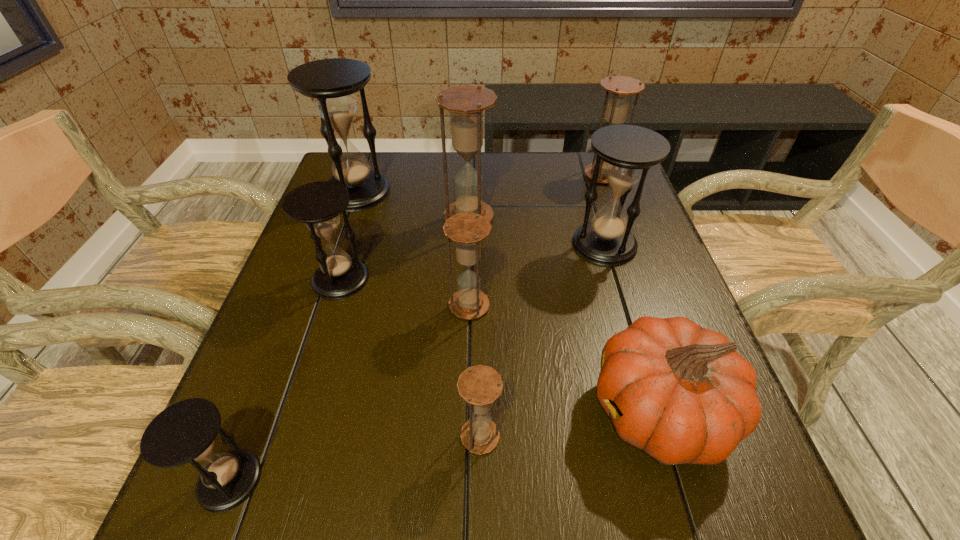
Identify the location of free space at the left edge of the desktop. The width and height of the screenshot is (960, 540). (348, 254).

In the image, there is a desktop. Where is `vacant area at the far left corner`? The width and height of the screenshot is (960, 540). vacant area at the far left corner is located at coordinates (331, 173).

This screenshot has height=540, width=960. I want to click on vacant space at the near left corner of the desktop, so click(282, 528).

Locate an element on the screen. vacant region at the far right corner of the desktop is located at coordinates (588, 165).

Locate an element on the screen. This screenshot has width=960, height=540. free space between the pumpkin and the third biggest black hourglass is located at coordinates (500, 345).

Find the location of a particular element. The height and width of the screenshot is (540, 960). blank region between the smallest black hourglass and the second smallest black hourglass is located at coordinates (285, 380).

Locate an element on the screen. unoccupied area between the second smallest brown hourglass and the farthest black hourglass is located at coordinates (413, 249).

This screenshot has width=960, height=540. Find the location of `unoccupied position between the second smallest black hourglass and the nearest black hourglass`. unoccupied position between the second smallest black hourglass and the nearest black hourglass is located at coordinates (285, 380).

The image size is (960, 540). Find the location of `free space between the nearest black hourglass and the orange pumpkin`. free space between the nearest black hourglass and the orange pumpkin is located at coordinates (444, 446).

The image size is (960, 540). Find the location of `free space between the nearest brown hourglass and the third biggest black hourglass`. free space between the nearest brown hourglass and the third biggest black hourglass is located at coordinates (411, 358).